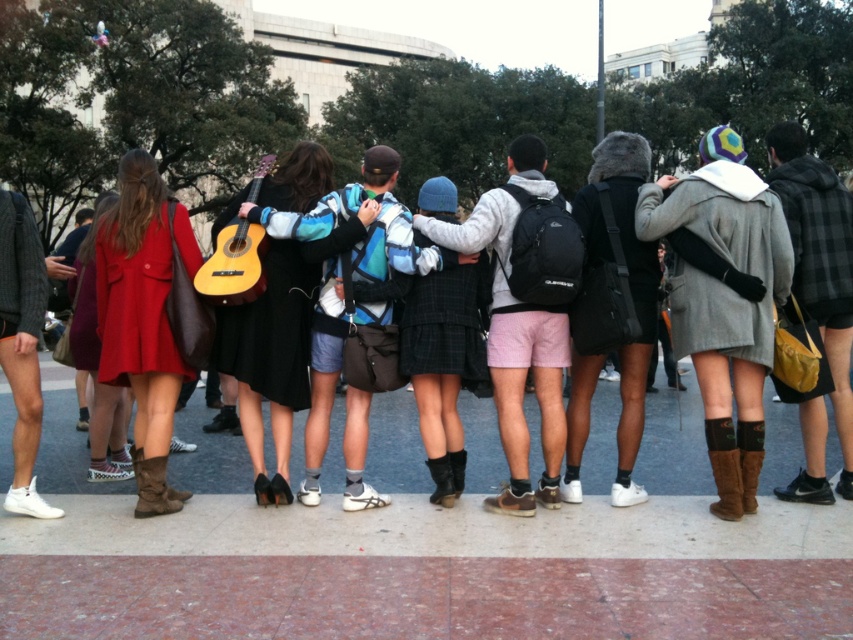
You are a photographer trying to capture a closeup shot of both the brown suede boot at lower right and the brown fuzzy boot at lower center without moving the subjects. Given their positions and sizes, which boot will appear larger in your photo?

The brown suede boot at lower right will appear larger in the photo because its width surpasses that of the brown fuzzy boot at lower center.

Based on the scene description, what object is located at the coordinates point (722, 291)?

The gray wool coat at center is located at point (722, 291).